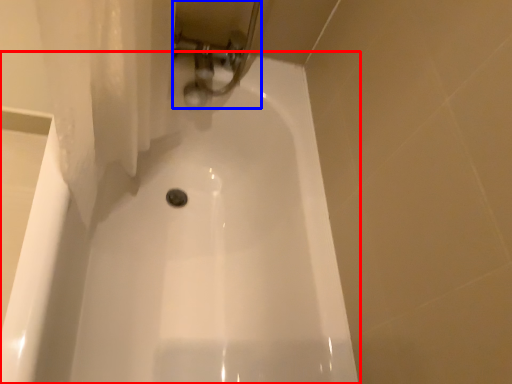
Question: Which object is closer to the camera taking this photo, bathtub (highlighted by a red box) or plumbing fixture (highlighted by a blue box)?

Choices:
 (A) bathtub
 (B) plumbing fixture

Answer: (A)